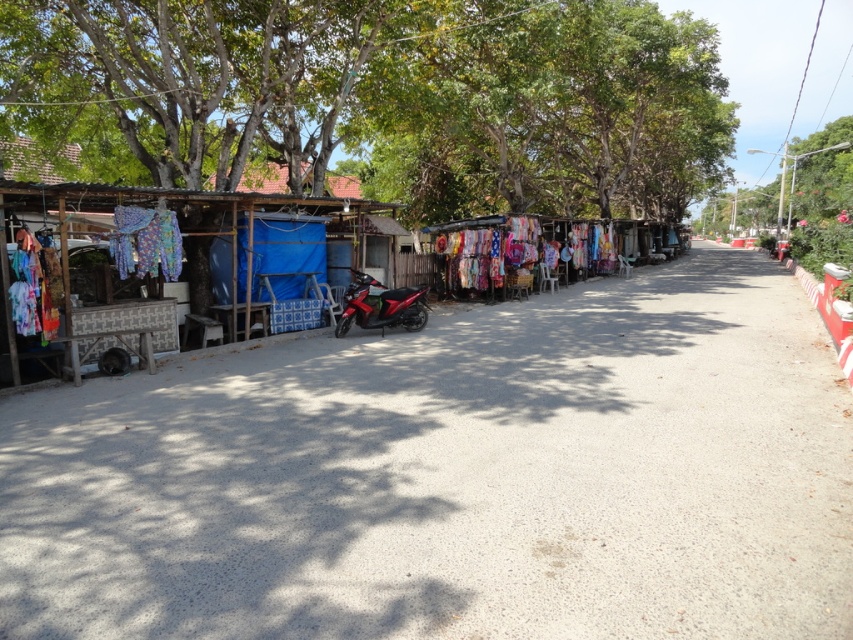
Which is behind, point (509, 186) or point (38, 259)?

Positioned behind is point (509, 186).

Which is above, green leafy tree at upper center or printed fabric at left?

green leafy tree at upper center is above.

Describe the element at coordinates (547, 112) in the screenshot. I see `green leafy tree at upper center` at that location.

You are a GUI agent. You are given a task and a screenshot of the screen. Output one action in this format:
    pyautogui.click(x=<x>, y=<y>)
    Task: Click on the green leafy tree at upper center
    The height and width of the screenshot is (640, 853).
    Given the screenshot: What is the action you would take?
    pyautogui.click(x=547, y=112)

Is colorful fabric at center wider than printed fabric at left?

Yes.

Is colorful fabric at center below printed fabric at left?

Actually, colorful fabric at center is above printed fabric at left.

Is point (479, 259) in front of point (10, 314)?

No, it is not.

Locate an element on the screen. This screenshot has height=640, width=853. colorful fabric at center is located at coordinates (546, 248).

Can you confirm if green leafy tree at upper right is shorter than floral fabric at left?

No.

Is green leafy tree at upper right to the left of floral fabric at left from the viewer's perspective?

Incorrect, green leafy tree at upper right is not on the left side of floral fabric at left.

Who is more forward, (x=799, y=195) or (x=126, y=237)?

Point (x=126, y=237)

I want to click on green leafy tree at upper right, so click(820, 177).